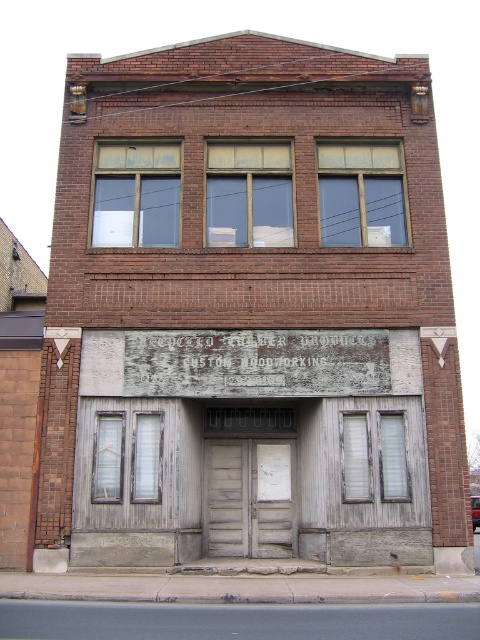
Looking at this image, measure the distance between matte wooden window at center and matte glass window at center.

matte wooden window at center and matte glass window at center are 4.00 feet apart from each other.

Between matte wooden window at center and matte glass window at center, which one is positioned higher?

matte glass window at center is higher up.

Is point (215, 225) more distant than point (367, 182)?

No, (215, 225) is in front of (367, 182).

The width and height of the screenshot is (480, 640). In order to click on matte wooden window at center in this screenshot , I will do pyautogui.click(x=249, y=193).

Is matte wooden window at center above wooden at center?

Yes.

Does matte wooden window at center lie behind wooden at center?

Yes, matte wooden window at center is behind wooden at center.

Locate an element on the screen. This screenshot has height=640, width=480. matte wooden window at center is located at coordinates (249, 193).

In order to click on matte wooden window at center in this screenshot , I will do `click(249, 193)`.

Can you confirm if weathered wood door at center is wider than matte wooden window at center?

No, weathered wood door at center is not wider than matte wooden window at center.

Does weathered wood door at center have a greater height compared to matte wooden window at center?

No.

This screenshot has height=640, width=480. What are the coordinates of `weathered wood door at center` in the screenshot? It's located at (250, 497).

Where is `weathered wood door at center`? Image resolution: width=480 pixels, height=640 pixels. weathered wood door at center is located at coordinates (250, 497).